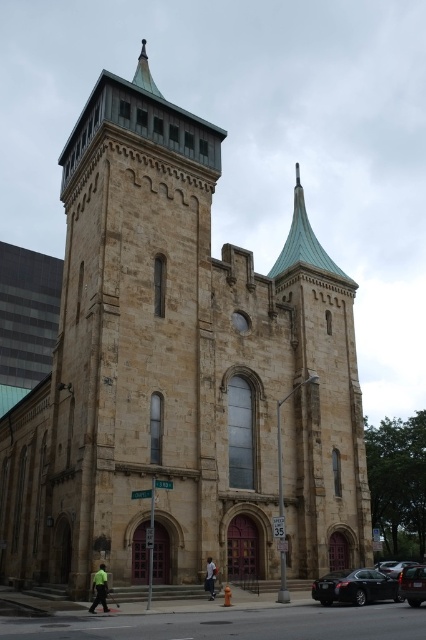
Question: Can you confirm if black matte car at lower right is positioned above shiny black sedan at center?

Choices:
 (A) no
 (B) yes

Answer: (B)

Question: Among these objects, which one is farthest from the camera?

Choices:
 (A) shiny black sedan at center
 (B) black matte car at lower right

Answer: (A)

Question: Among these objects, which one is farthest from the camera?

Choices:
 (A) dark blue jeans at center
 (B) shiny black sedan at center
 (C) shiny black sedan at lower right
 (D) green fabric person at lower left

Answer: (B)

Question: Is shiny copper spire at upper center below shiny black sedan at center?

Choices:
 (A) no
 (B) yes

Answer: (A)

Question: Is black matte car at lower right below shiny black sedan at center?

Choices:
 (A) no
 (B) yes

Answer: (A)

Question: Which point is closer to the camera taking this photo?

Choices:
 (A) (354, 588)
 (B) (380, 566)
 (C) (141, 83)

Answer: (A)